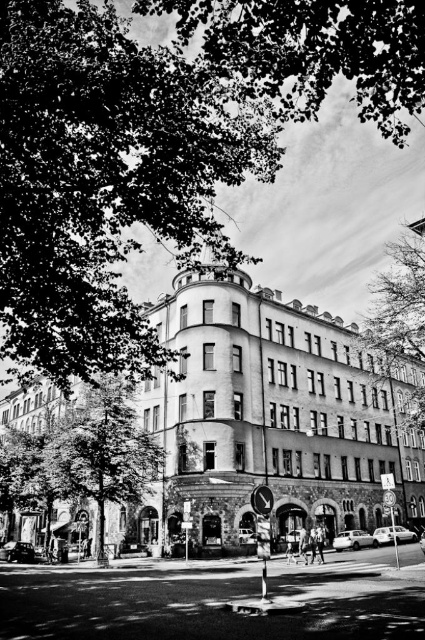
Is green leafy tree at upper left further to the viewer compared to green leafy tree at upper right?

No.

Based on the photo, which is above, green leafy tree at upper left or green leafy tree at upper right?

green leafy tree at upper left is above.

The height and width of the screenshot is (640, 425). Find the location of `green leafy tree at upper left`. green leafy tree at upper left is located at coordinates (105, 179).

Does point (93, 467) come farther from viewer compared to point (371, 324)?

No, it is not.

Based on the photo, between green leafy tree at center and green leafy tree at upper right, which one is positioned lower?

green leafy tree at center

The height and width of the screenshot is (640, 425). I want to click on green leafy tree at center, so click(x=101, y=451).

At what (x,y) coordinates should I click in order to perform the action: click on green leafy tree at center. Please return your answer as a coordinate pair (x, y). Looking at the image, I should click on (101, 451).

Between dark green leafy tree at upper center and green leafy tree at upper right, which one has more height?

dark green leafy tree at upper center

Between point (260, 40) and point (388, 330), which one is positioned behind?

The point (388, 330) is more distant.

Find the location of a particular element. The width and height of the screenshot is (425, 640). dark green leafy tree at upper center is located at coordinates (312, 51).